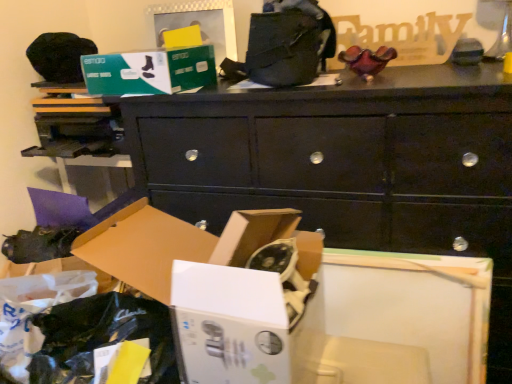
How much space does green cardboard box at upper center, placed as the first storage box when sorted from top to bottom, occupy horizontally?

green cardboard box at upper center, placed as the first storage box when sorted from top to bottom, is 9.65 inches wide.

This screenshot has width=512, height=384. Identify the location of matte black shoe at lower left. (39, 244).

Locate an element on the screen. The image size is (512, 384). black matte chest of drawers at center is located at coordinates (348, 165).

What's the angular difference between white cardboard box at lower left, the 1th storage box from the bottom, and matte black shoe at lower left's facing directions?

white cardboard box at lower left, the 1th storage box from the bottom, and matte black shoe at lower left are facing 13.8 degrees away from each other.

From a real-world perspective, is white cardboard box at lower left, the 1th storage box from the bottom, positioned above or below matte black shoe at lower left?

In terms of real-world spatial position, white cardboard box at lower left, the 1th storage box from the bottom, is above matte black shoe at lower left.

Can you confirm if white cardboard box at lower left, the 1th storage box from the bottom, is smaller than matte black shoe at lower left?

Incorrect, white cardboard box at lower left, the 1th storage box from the bottom, is not smaller in size than matte black shoe at lower left.

Is white cardboard box at lower left, the second storage box viewed from the top, taller or shorter than matte black shoe at lower left?

Clearly, white cardboard box at lower left, the second storage box viewed from the top, is taller compared to matte black shoe at lower left.

How different are the orientations of black matte chest of drawers at center and white cardboard box at lower left, the 1th storage box from the bottom, in degrees?

The angle between the facing direction of black matte chest of drawers at center and the facing direction of white cardboard box at lower left, the 1th storage box from the bottom, is 1.29 degrees.

Does black matte chest of drawers at center lie behind white cardboard box at lower left, the second storage box viewed from the top?

Yes, black matte chest of drawers at center is further from the camera.

Can you confirm if black matte chest of drawers at center is taller than white cardboard box at lower left, the 1th storage box from the bottom?

Yes, black matte chest of drawers at center is taller than white cardboard box at lower left, the 1th storage box from the bottom.

Is point (392, 125) closer or farther from the camera than point (138, 250)?

Point (392, 125) is positioned farther from the camera compared to point (138, 250).

Can you tell me how much green cardboard box at upper center, placed as the first storage box when sorted from top to bottom, and white cardboard box at lower left, the 1th storage box from the bottom, differ in facing direction?

9.06 degrees.

Considering the relative sizes of green cardboard box at upper center, placed as the first storage box when sorted from top to bottom, and white cardboard box at lower left, the second storage box viewed from the top, in the image provided, is green cardboard box at upper center, placed as the first storage box when sorted from top to bottom, shorter than white cardboard box at lower left, the second storage box viewed from the top,?

Correct, green cardboard box at upper center, placed as the first storage box when sorted from top to bottom, is not as tall as white cardboard box at lower left, the second storage box viewed from the top.

Is green cardboard box at upper center, which ranks as the 2th storage box in bottom-to-top order, positioned far away from white cardboard box at lower left, the second storage box viewed from the top?

No, green cardboard box at upper center, which ranks as the 2th storage box in bottom-to-top order, is not far away from white cardboard box at lower left, the second storage box viewed from the top.

Looking at this image, is green cardboard box at upper center, which ranks as the 2th storage box in bottom-to-top order, wider or thinner than white cardboard box at lower left, the 1th storage box from the bottom?

In the image, green cardboard box at upper center, which ranks as the 2th storage box in bottom-to-top order, appears to be more narrow than white cardboard box at lower left, the 1th storage box from the bottom.

Considering their positions, is black matte chest of drawers at center located in front of or behind green cardboard box at upper center, which ranks as the 2th storage box in bottom-to-top order?

black matte chest of drawers at center is positioned closer to the viewer than green cardboard box at upper center, which ranks as the 2th storage box in bottom-to-top order.

How many degrees apart are the facing directions of black matte chest of drawers at center and green cardboard box at upper center, which ranks as the 2th storage box in bottom-to-top order?

7.77 degrees separate the facing orientations of black matte chest of drawers at center and green cardboard box at upper center, which ranks as the 2th storage box in bottom-to-top order.

Is black matte chest of drawers at center placed right next to green cardboard box at upper center, which ranks as the 2th storage box in bottom-to-top order?

No, black matte chest of drawers at center is not touching green cardboard box at upper center, which ranks as the 2th storage box in bottom-to-top order.

Who is bigger, black matte chest of drawers at center or green cardboard box at upper center, placed as the first storage box when sorted from top to bottom?

black matte chest of drawers at center.

Is white cardboard box at lower left, the 1th storage box from the bottom, looking in the opposite direction of black matte chest of drawers at center?

Correct, white cardboard box at lower left, the 1th storage box from the bottom, is looking away from black matte chest of drawers at center.

Which of these two, white cardboard box at lower left, the 1th storage box from the bottom, or black matte chest of drawers at center, stands shorter?

With less height is white cardboard box at lower left, the 1th storage box from the bottom.

You are a GUI agent. You are given a task and a screenshot of the screen. Output one action in this format:
    pyautogui.click(x=<x>, y=<y>)
    Task: Click on the chest of drawers on the right of white cardboard box at lower left, the 1th storage box from the bottom
    The height and width of the screenshot is (384, 512).
    Given the screenshot: What is the action you would take?
    pyautogui.click(x=348, y=165)

From the image's perspective, is white cardboard box at lower left, the second storage box viewed from the top, under black matte chest of drawers at center?

Correct, white cardboard box at lower left, the second storage box viewed from the top, appears lower than black matte chest of drawers at center in the image.

Who is shorter, black matte chest of drawers at center or matte black shoe at lower left?

With less height is matte black shoe at lower left.

Looking at their sizes, would you say black matte chest of drawers at center is wider or thinner than matte black shoe at lower left?

black matte chest of drawers at center is wider than matte black shoe at lower left.

Where is `the chest of drawers above the matte black shoe at lower left (from the image's perspective)`? the chest of drawers above the matte black shoe at lower left (from the image's perspective) is located at coordinates (348, 165).

Would you say black matte chest of drawers at center is inside or outside matte black shoe at lower left?

black matte chest of drawers at center lies outside matte black shoe at lower left.

Between matte black shoe at lower left and green cardboard box at upper center, placed as the first storage box when sorted from top to bottom, which one has larger width?

Wider between the two is green cardboard box at upper center, placed as the first storage box when sorted from top to bottom.

From the image's perspective, who appears lower, matte black shoe at lower left or green cardboard box at upper center, placed as the first storage box when sorted from top to bottom?

From the image's view, matte black shoe at lower left is below.

From a real-world perspective, is matte black shoe at lower left under green cardboard box at upper center, which ranks as the 2th storage box in bottom-to-top order?

Indeed, from a real-world perspective, matte black shoe at lower left is positioned beneath green cardboard box at upper center, which ranks as the 2th storage box in bottom-to-top order.

From the picture: Does matte black shoe at lower left have a smaller size compared to green cardboard box at upper center, which ranks as the 2th storage box in bottom-to-top order?

Indeed, matte black shoe at lower left has a smaller size compared to green cardboard box at upper center, which ranks as the 2th storage box in bottom-to-top order.

Where is `the 1st storage box located above the matte black shoe at lower left (from a real-world perspective)`? the 1st storage box located above the matte black shoe at lower left (from a real-world perspective) is located at coordinates (211, 278).

Locate an element on the screen. This screenshot has width=512, height=384. storage box that is below the black matte chest of drawers at center (from the image's perspective) is located at coordinates (211, 278).

Estimate the real-world distances between objects in this image. Which object is further from black matte chest of drawers at center, white cardboard box at lower left, the 1th storage box from the bottom, or matte black shoe at lower left?

Among the two, matte black shoe at lower left is located further to black matte chest of drawers at center.

Based on their spatial positions, is black matte chest of drawers at center or green cardboard box at upper center, which ranks as the 2th storage box in bottom-to-top order, closer to white cardboard box at lower left, the second storage box viewed from the top?

The object closer to white cardboard box at lower left, the second storage box viewed from the top, is black matte chest of drawers at center.

Considering their positions, is black matte chest of drawers at center positioned further to green cardboard box at upper center, placed as the first storage box when sorted from top to bottom, than matte black shoe at lower left?

The object further to green cardboard box at upper center, placed as the first storage box when sorted from top to bottom, is matte black shoe at lower left.

Based on their spatial positions, is matte black shoe at lower left or white cardboard box at lower left, the second storage box viewed from the top, further from green cardboard box at upper center, which ranks as the 2th storage box in bottom-to-top order?

matte black shoe at lower left.

From the image, which object appears to be nearer to white cardboard box at lower left, the 1th storage box from the bottom, black matte chest of drawers at center or matte black shoe at lower left?

Among the two, black matte chest of drawers at center is located nearer to white cardboard box at lower left, the 1th storage box from the bottom.

Looking at the image, which one is located further to black matte chest of drawers at center, green cardboard box at upper center, placed as the first storage box when sorted from top to bottom, or white cardboard box at lower left, the second storage box viewed from the top?

white cardboard box at lower left, the second storage box viewed from the top.

Estimate the real-world distances between objects in this image. Which object is further from white cardboard box at lower left, the second storage box viewed from the top, matte black shoe at lower left or green cardboard box at upper center, placed as the first storage box when sorted from top to bottom?

matte black shoe at lower left.

When comparing their distances from white cardboard box at lower left, the second storage box viewed from the top, does green cardboard box at upper center, placed as the first storage box when sorted from top to bottom, or black matte chest of drawers at center seem further?

green cardboard box at upper center, placed as the first storage box when sorted from top to bottom, lies further to white cardboard box at lower left, the second storage box viewed from the top, than the other object.

At what (x,y) coordinates should I click in order to perform the action: click on storage box between white cardboard box at lower left, the 1th storage box from the bottom, and matte black shoe at lower left, along the z-axis. Please return your answer as a coordinate pair (x, y). Image resolution: width=512 pixels, height=384 pixels. Looking at the image, I should click on (149, 71).

The height and width of the screenshot is (384, 512). I want to click on chest of drawers between green cardboard box at upper center, placed as the first storage box when sorted from top to bottom, and white cardboard box at lower left, the 1th storage box from the bottom, from top to bottom, so click(x=348, y=165).